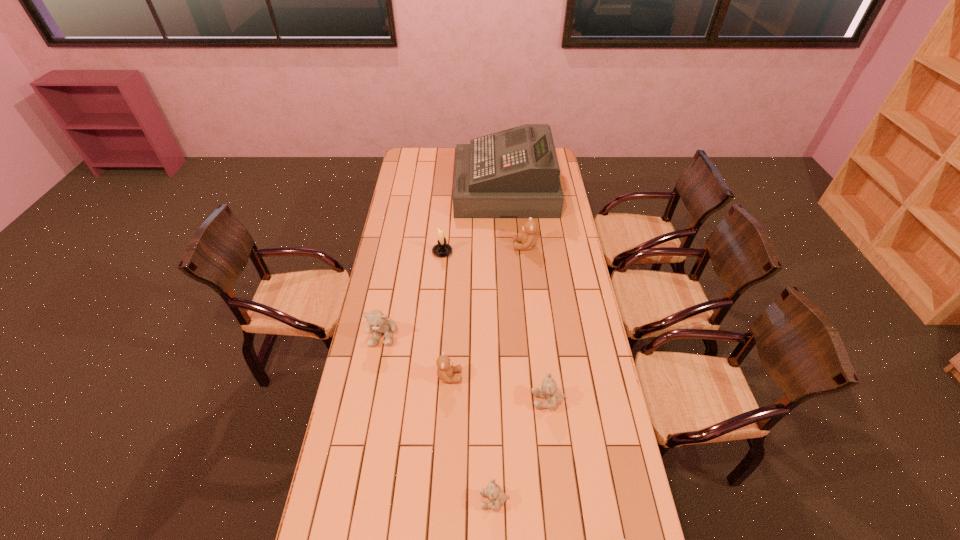
Find the location of a particular element. The height and width of the screenshot is (540, 960). the second biggest gray teddy bear is located at coordinates (548, 390).

This screenshot has height=540, width=960. What are the coordinates of `the second nearest object` in the screenshot? It's located at (498, 497).

This screenshot has width=960, height=540. Identify the location of the second gray teddy bear from left to right. (498, 497).

Identify the location of free location located on the front-facing side of the farthest object. (432, 189).

You are a GUI agent. You are given a task and a screenshot of the screen. Output one action in this format:
    pyautogui.click(x=<x>, y=<y>)
    Task: Click on the blank space located 0.130m on the front-facing side of the farthest object
    
    Given the screenshot: What is the action you would take?
    pyautogui.click(x=432, y=189)

Identify the location of vacant region located on the front-facing side of the farthest object. The height and width of the screenshot is (540, 960). (425, 189).

Locate an element on the screen. This screenshot has height=540, width=960. free space located 0.310m on the front of the white candle holder is located at coordinates (437, 310).

You are a GUI agent. You are given a task and a screenshot of the screen. Output one action in this format:
    pyautogui.click(x=<x>, y=<y>)
    Task: Click on the free location located 0.150m on the front-facing side of the biggest brown teddy bear
    The height and width of the screenshot is (540, 960).
    Given the screenshot: What is the action you would take?
    pyautogui.click(x=482, y=246)

The image size is (960, 540). What are the coordinates of `free location located on the front-facing side of the biggest brown teddy bear` in the screenshot? It's located at (437, 246).

I want to click on free space located 0.080m on the front-facing side of the biggest brown teddy bear, so click(x=496, y=246).